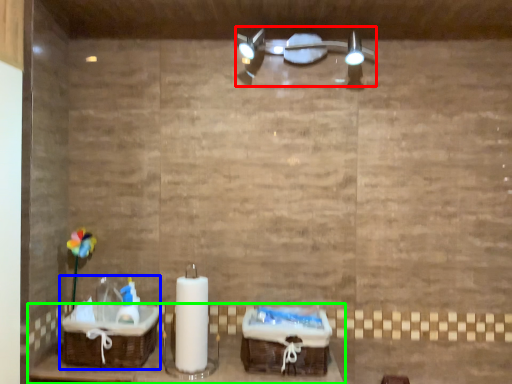
Question: Considering the real-world distances, which object is closest to light fixture (highlighted by a red box)? sink (highlighted by a blue box) or furniture (highlighted by a green box).

Choices:
 (A) sink
 (B) furniture

Answer: (B)